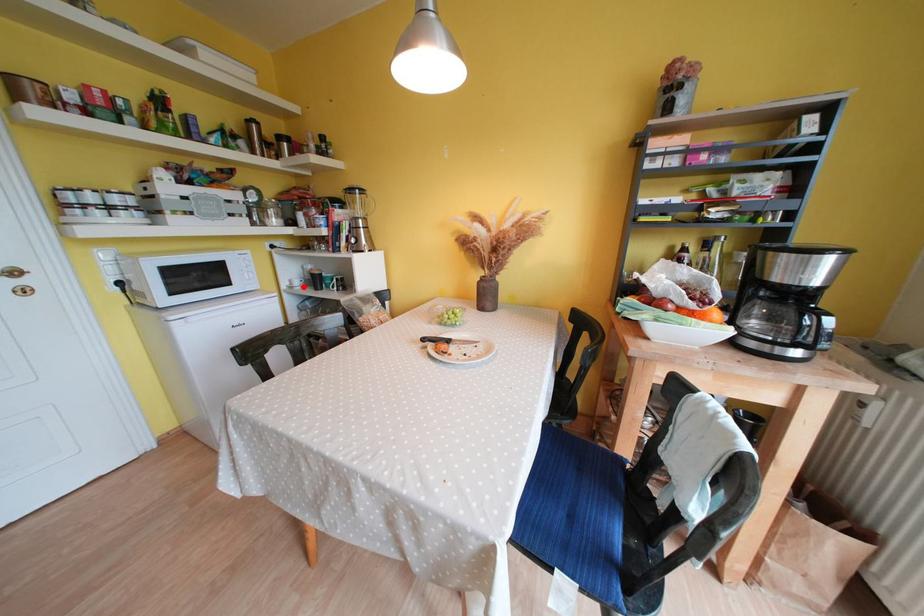
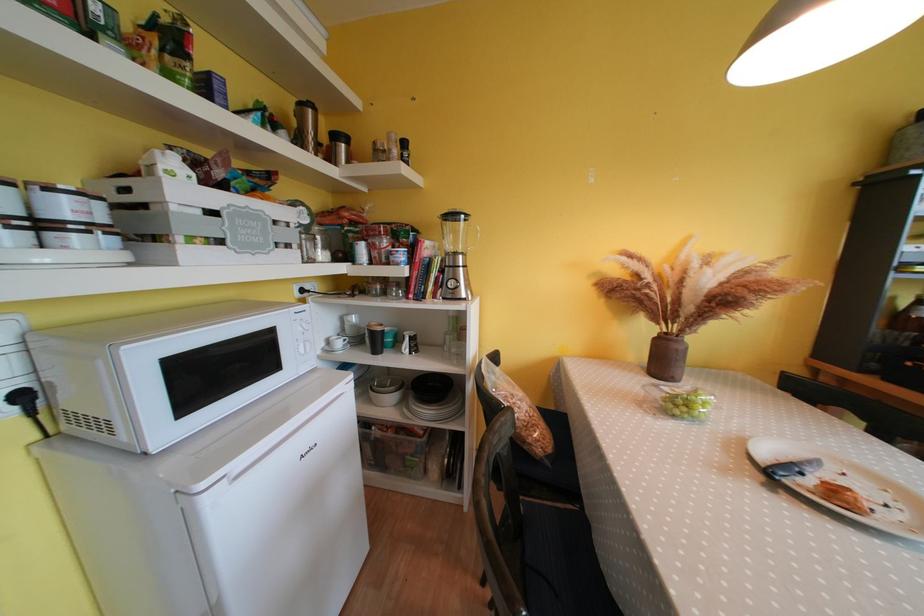
Find the pixel in the second image that matches the highlighted location in the first image.

(345, 347)